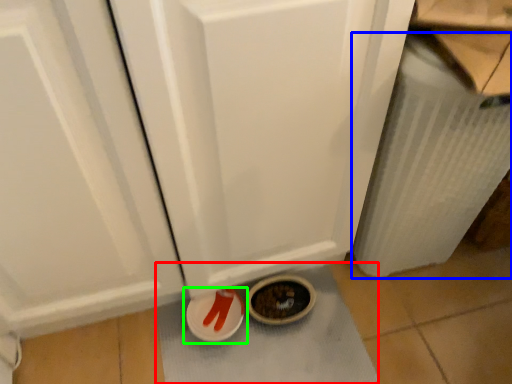
Question: Based on their relative distances, which object is nearer to bath mat (highlighted by a red box)? Choose from radiator (highlighted by a blue box) and footwear (highlighted by a green box).

Choices:
 (A) radiator
 (B) footwear

Answer: (B)